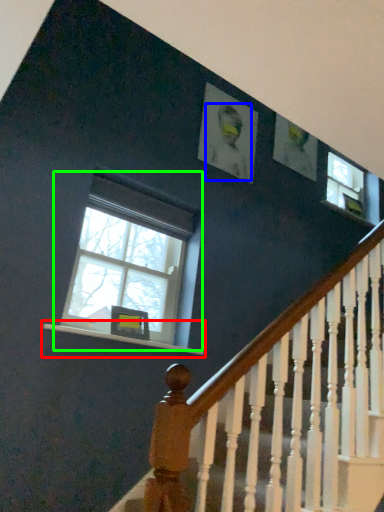
Question: Which is farther away from window sill (highlighted by a red box)? person (highlighted by a blue box) or window (highlighted by a green box)?

Choices:
 (A) person
 (B) window

Answer: (A)